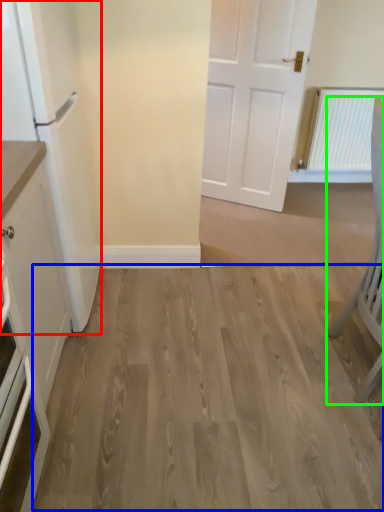
Question: Considering the real-world distances, which object is farthest from fridge (highlighted by a red box)? hardwood (highlighted by a blue box) or chair (highlighted by a green box)?

Choices:
 (A) hardwood
 (B) chair

Answer: (B)